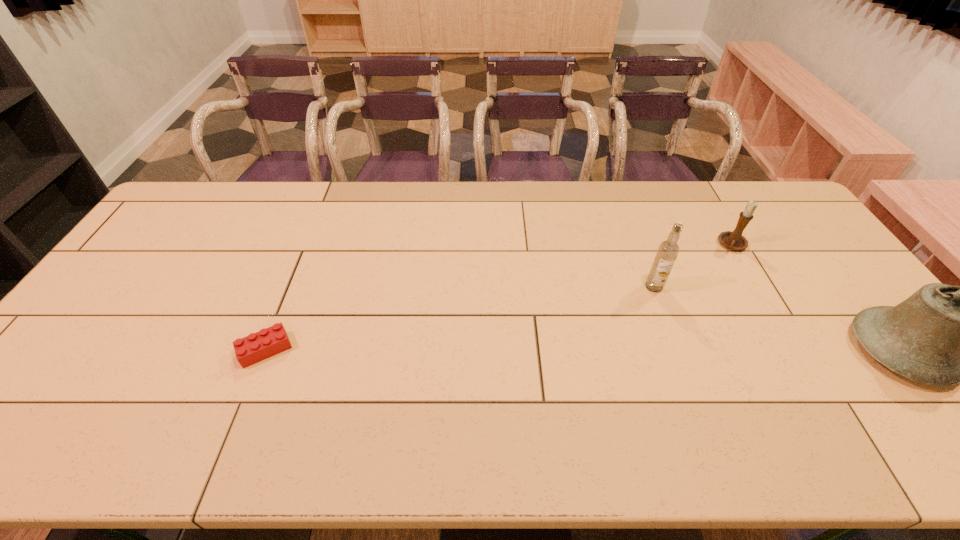
You are a GUI agent. You are given a task and a screenshot of the screen. Output one action in this format:
    pyautogui.click(x=<x>, y=<y>)
    Task: Click on the vacant area that lies between the vodka and the shortest object
    The image size is (960, 540).
    Given the screenshot: What is the action you would take?
    pyautogui.click(x=460, y=318)

You are a GUI agent. You are given a task and a screenshot of the screen. Output one action in this format:
    pyautogui.click(x=<x>, y=<y>)
    Task: Click on the free space between the leftmost object and the farthest object
    The image size is (960, 540).
    Given the screenshot: What is the action you would take?
    pyautogui.click(x=499, y=297)

Image resolution: width=960 pixels, height=540 pixels. What are the coordinates of `vacant space in between the candle holder and the shortest object` in the screenshot? It's located at (499, 297).

Image resolution: width=960 pixels, height=540 pixels. What are the coordinates of `vacant point located between the leftmost object and the candle holder` in the screenshot? It's located at (499, 297).

Find the location of a particular element. free space that is in between the second object from left to right and the farthest object is located at coordinates (693, 266).

You are a GUI agent. You are given a task and a screenshot of the screen. Output one action in this format:
    pyautogui.click(x=<x>, y=<y>)
    Task: Click on the object that ranks as the second closest to the third nearest object
    This screenshot has width=960, height=540.
    Given the screenshot: What is the action you would take?
    pyautogui.click(x=942, y=335)

This screenshot has height=540, width=960. Find the location of `object that ranks as the closest to the Lego`. object that ranks as the closest to the Lego is located at coordinates (668, 250).